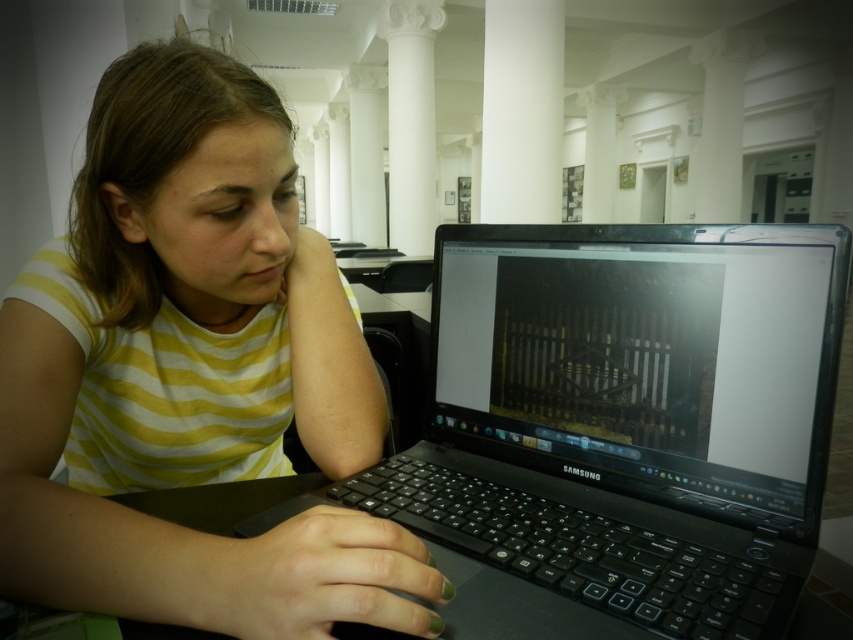
You are organizing a small event and need to set up a table and laptop in a way that the laptop is clearly visible to attendees. Based on the scene, is the current placement of the black plastic laptop at center and black plastic table at center suitable for this purpose?

The black plastic laptop at center is in front of the black plastic table at center, meaning it is positioned closer to the attendees, making it clearly visible.

What object is located at the coordinates point (619, 428) in the image?

The black plastic laptop at center is located at point (619, 428).

Based on the scene description, where is the yellow striped shirt at center located in terms of its 2D coordinates?

The yellow striped shirt at center is located at the 2D coordinates of point (x=190, y=372).